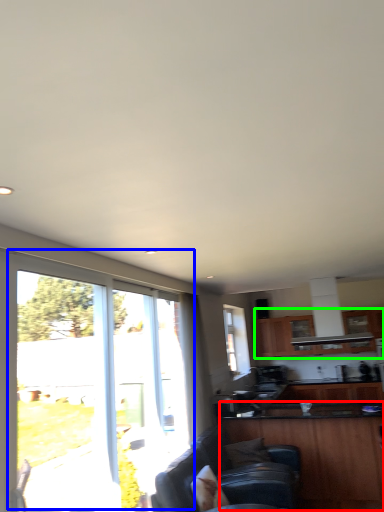
Question: Considering the real-world distances, which object is closest to cabinetry (highlighted by a red box)? window (highlighted by a blue box) or cabinetry (highlighted by a green box).

Choices:
 (A) window
 (B) cabinetry

Answer: (B)